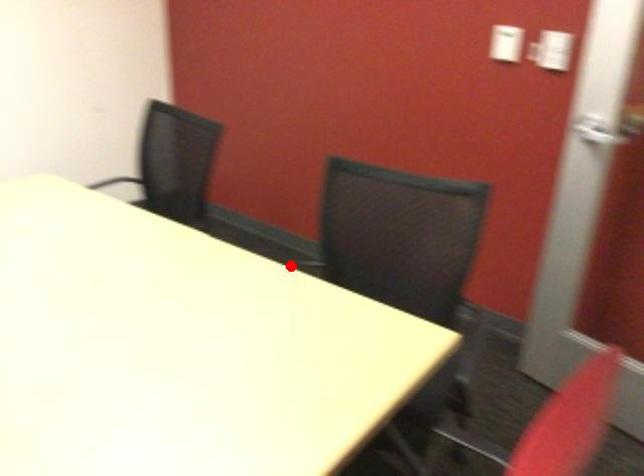
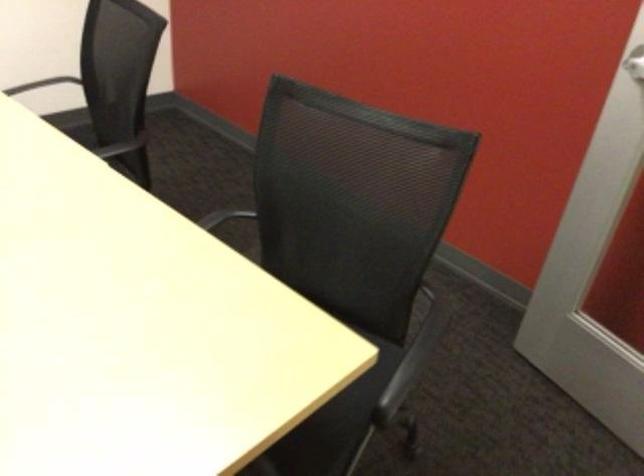
Question: I am providing you with two images of the same scene from different viewpoints. Image1 has a red point marked. In image2, the corresponding 3D location appears at what relative position? Reply with the corresponding letter.

Choices:
 (A) Closer
 (B) Farther

Answer: (A)